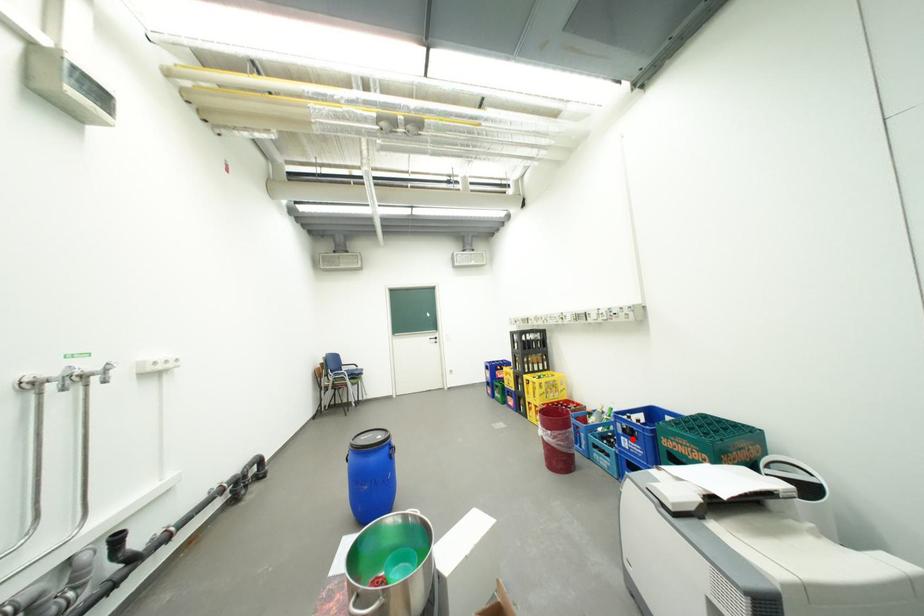
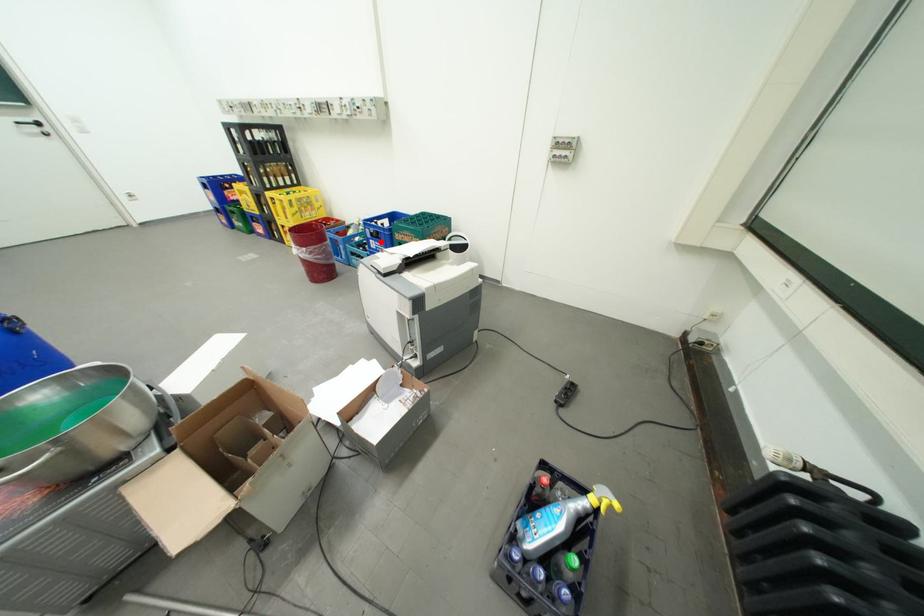
I am providing you with two images of the same scene from different viewpoints. A red point is marked on the first image and another point is marked on the second image. Does the point marked in image1 correspond to the same location as the one in image2?

Yes